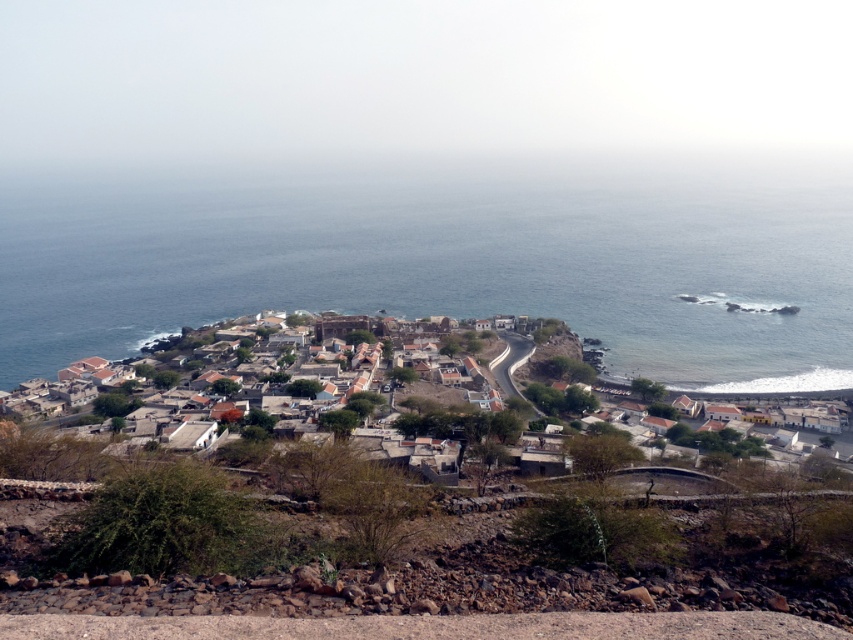
Who is more forward, [49,337] or [51,364]?

Positioned in front is point [51,364].

Is point (811, 244) less distant than point (560, 352)?

No, it is not.

Between point (419, 294) and point (792, 392), which one is positioned behind?

The point (419, 294) is more distant.

Image resolution: width=853 pixels, height=640 pixels. In order to click on blue water at center in this screenshot , I will do `click(440, 257)`.